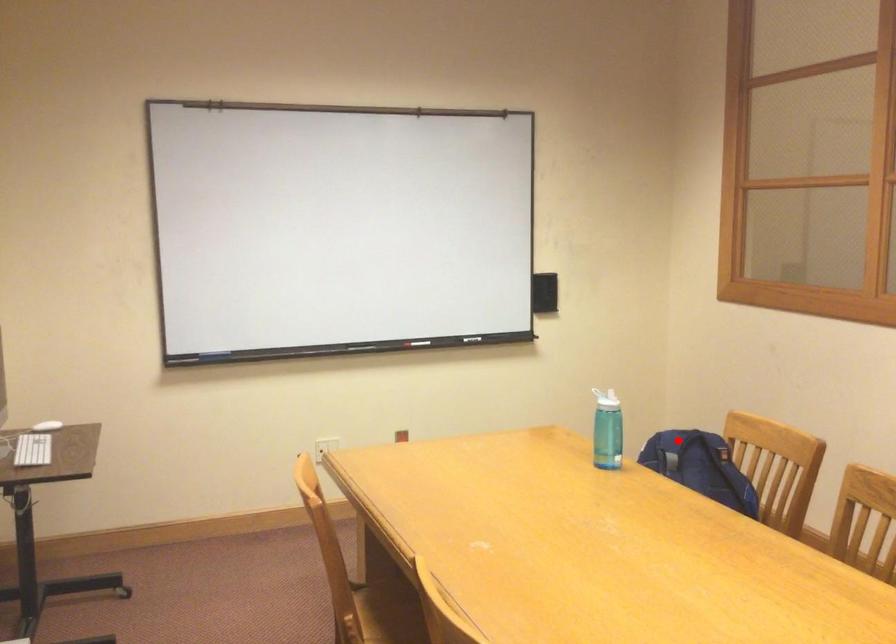
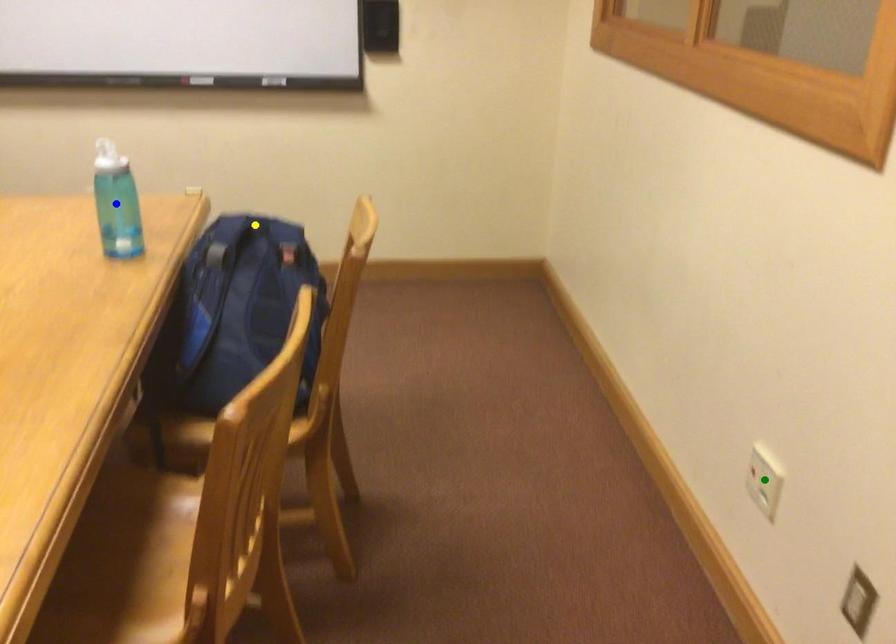
Question: I am providing you with two images of the same scene from different viewpoints. A red point is marked on the first image. You are given multiple points on the second image. Which mark in image 2 goes with the point in image 1?

Choices:
 (A) yellow point
 (B) green point
 (C) blue point

Answer: (A)